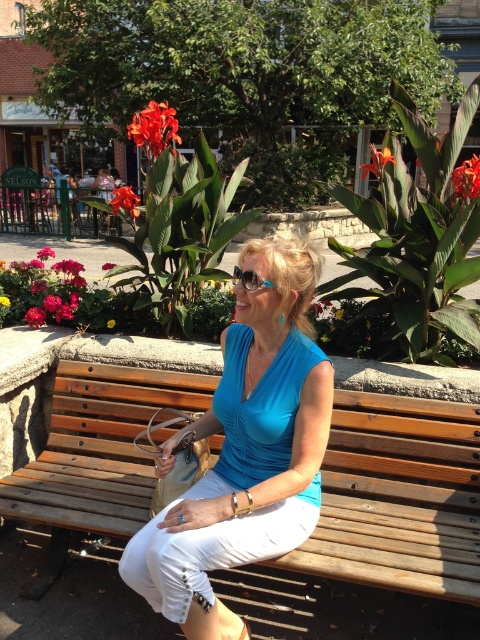
Question: Which of the following is the closest to the observer?

Choices:
 (A) (269, 282)
 (B) (145, 124)

Answer: (A)

Question: Does matte pink flowers at upper left appear on the left side of smooth glossy flower at upper left?

Choices:
 (A) no
 (B) yes

Answer: (A)

Question: Estimate the real-world distances between objects in this image. Which object is farther from the matte pink flowers at upper left?

Choices:
 (A) blue fabric blouse at center
 (B) orange glossy canna lily at center

Answer: (B)

Question: Which of the following is the farthest from the observer?

Choices:
 (A) matte pink flowers at upper left
 (B) pink fabric flower at lower left
 (C) orange glossy flower at upper right

Answer: (A)

Question: Does orange glossy flower at upper right appear under smooth glossy flower at upper left?

Choices:
 (A) yes
 (B) no

Answer: (B)

Question: Can you confirm if matte red flower at center is positioned to the right of yellow textured petals at center?

Choices:
 (A) yes
 (B) no

Answer: (B)